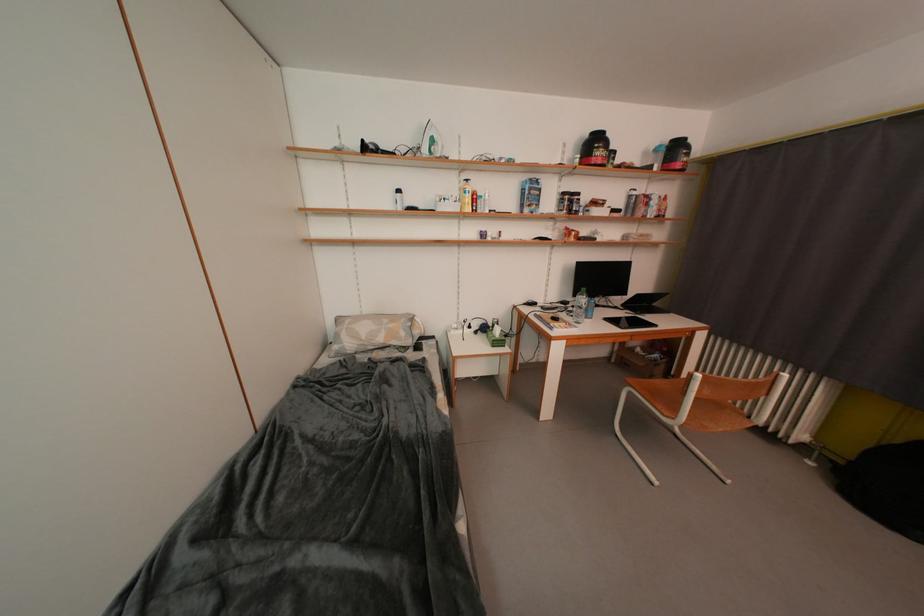
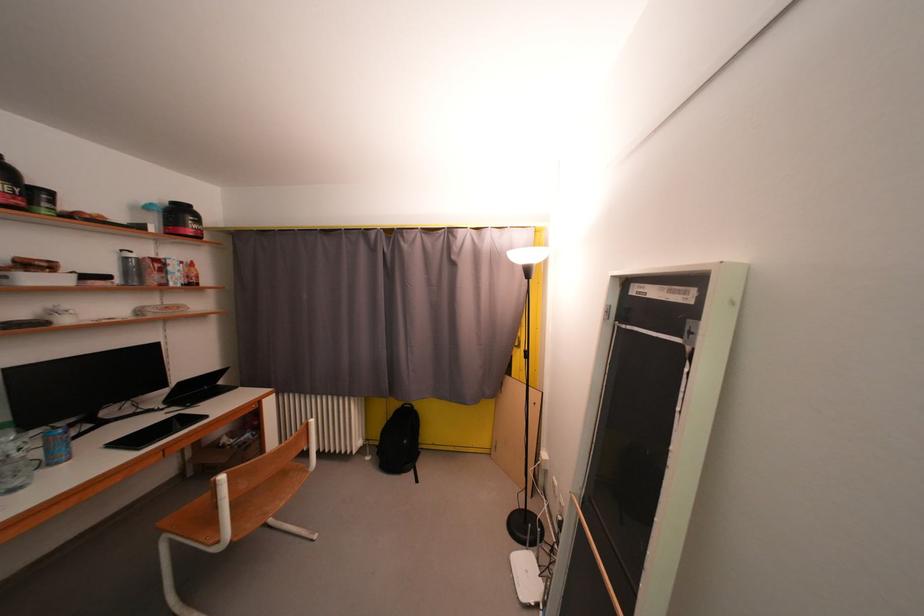
Locate, in the second image, the point that corresponds to (588,323) in the first image.

(25, 487)